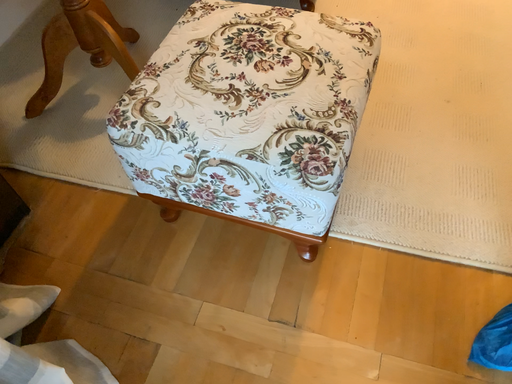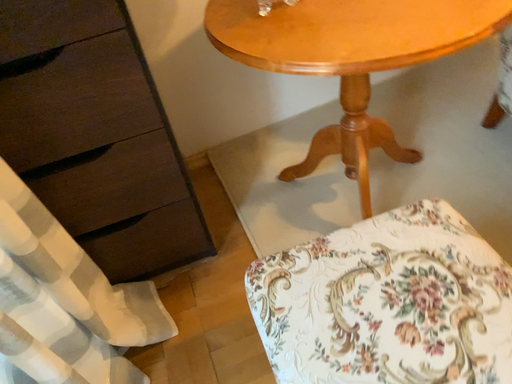
Question: Which way did the camera rotate in the video?

Choices:
 (A) rotated downward
 (B) rotated upward

Answer: (B)